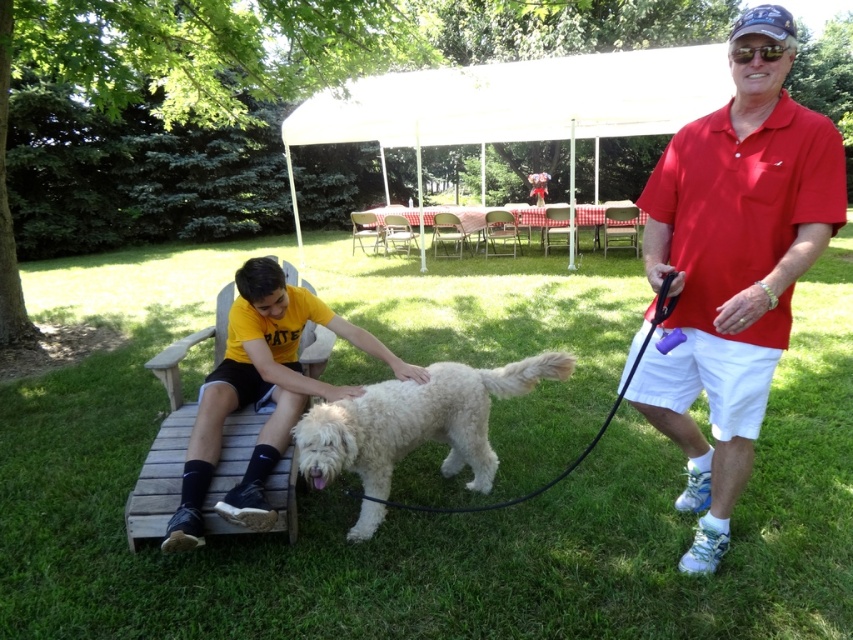
Which is behind, point (380, 209) or point (621, 396)?

Positioned behind is point (380, 209).

Can you confirm if red checkered tablecloth at center is positioned to the left of black rubber leash at center?

In fact, red checkered tablecloth at center is to the right of black rubber leash at center.

Between point (527, 212) and point (569, 472), which one is positioned behind?

The point (527, 212) is more distant.

This screenshot has height=640, width=853. What are the coordinates of `red checkered tablecloth at center` in the screenshot? It's located at (469, 216).

The image size is (853, 640). What are the coordinates of `red cotton shirt at right` in the screenshot? It's located at (733, 262).

Between point (741, 408) and point (434, 211), which one is positioned in front?

Point (741, 408) is more forward.

You are a GUI agent. You are given a task and a screenshot of the screen. Output one action in this format:
    pyautogui.click(x=<x>, y=<y>)
    Task: Click on the red cotton shirt at right
    
    Given the screenshot: What is the action you would take?
    pyautogui.click(x=733, y=262)

Which is in front, point (358, 428) or point (462, 509)?

Positioned in front is point (358, 428).

Which is more to the left, white fluffy dog at center or black rubber leash at center?

white fluffy dog at center

The image size is (853, 640). Find the location of `white fluffy dog at center`. white fluffy dog at center is located at coordinates (415, 426).

The width and height of the screenshot is (853, 640). Find the location of `white fluffy dog at center`. white fluffy dog at center is located at coordinates (415, 426).